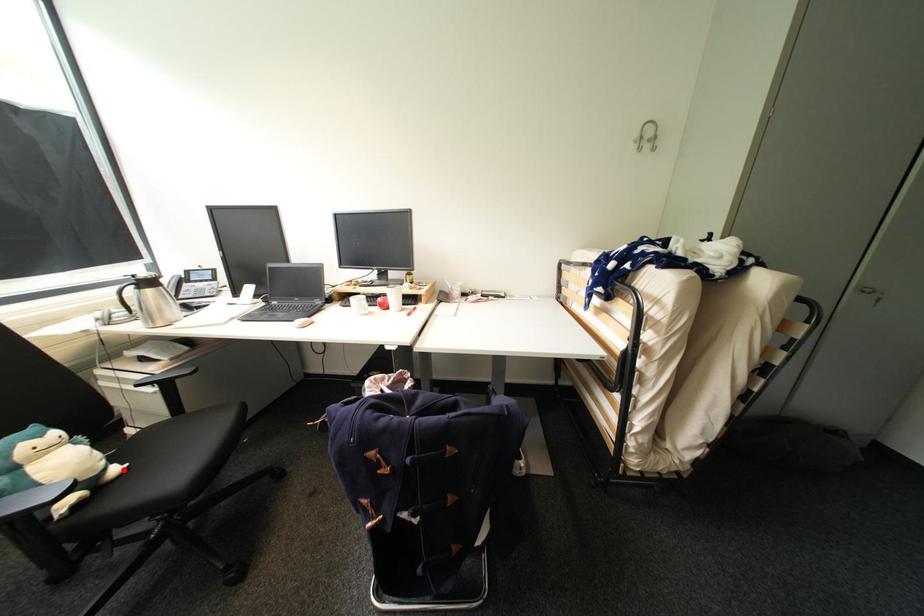
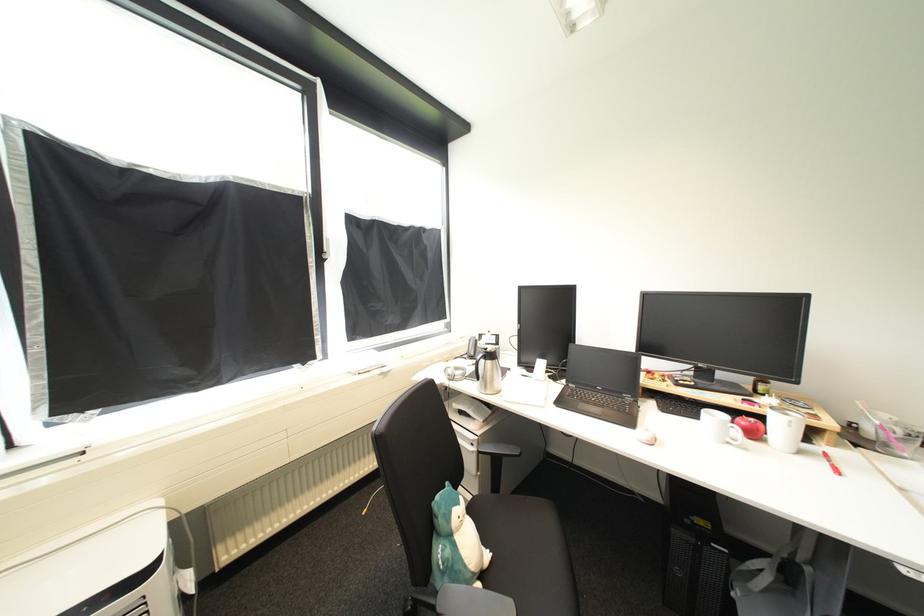
Question: I am providing you with two images of the same scene from different viewpoints. A red point is marked on the first image. Can you still see the location of the red point in image 2?

Choices:
 (A) Yes
 (B) No

Answer: (A)